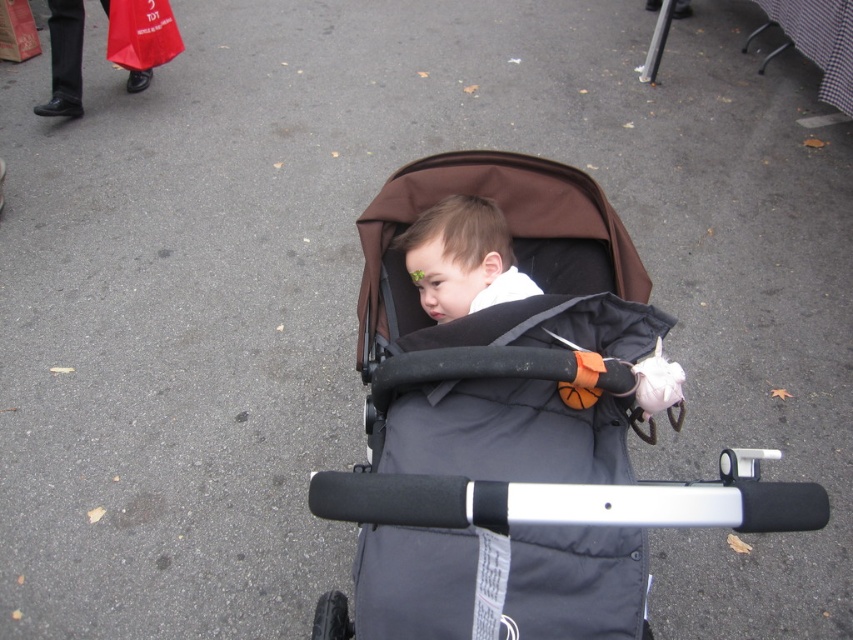
Question: Observing the image, what is the correct spatial positioning of black fabric baby carriage at center in reference to matte black toddler at center?

Choices:
 (A) right
 (B) left

Answer: (A)

Question: Can you confirm if black fabric baby carriage at center is positioned to the left of matte black toddler at center?

Choices:
 (A) yes
 (B) no

Answer: (B)

Question: Among these objects, which one is farthest from the camera?

Choices:
 (A) black fabric baby carriage at center
 (B) matte black toddler at center

Answer: (B)

Question: Can you confirm if black fabric baby carriage at center is positioned below matte black toddler at center?

Choices:
 (A) no
 (B) yes

Answer: (B)

Question: Which point is closer to the camera?

Choices:
 (A) matte black toddler at center
 (B) black fabric baby carriage at center

Answer: (B)